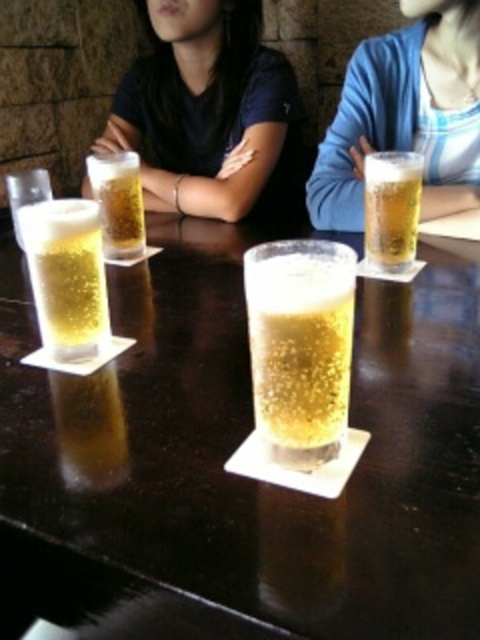
Question: Is clear glass beer at center bigger than translucent glass beer at right?

Choices:
 (A) yes
 (B) no

Answer: (A)

Question: Does translucent glass beer at right have a smaller size compared to translucent glass beer at center?

Choices:
 (A) no
 (B) yes

Answer: (A)

Question: Which point is closer to the camera?

Choices:
 (A) (339, 305)
 (B) (396, 243)

Answer: (A)

Question: Which point is closer to the camera?

Choices:
 (A) translucent glass beer at left
 (B) clear glass beer at center
 (C) blue cotton sweater at upper center
 (D) translucent glass beer at right

Answer: (B)

Question: Can you confirm if translucent glass at center is positioned to the right of translucent glass beer at left?

Choices:
 (A) no
 (B) yes

Answer: (B)

Question: Based on their relative distances, which object is nearer to the clear glass beer at center?

Choices:
 (A) translucent glass beer at center
 (B) translucent glass at center

Answer: (B)